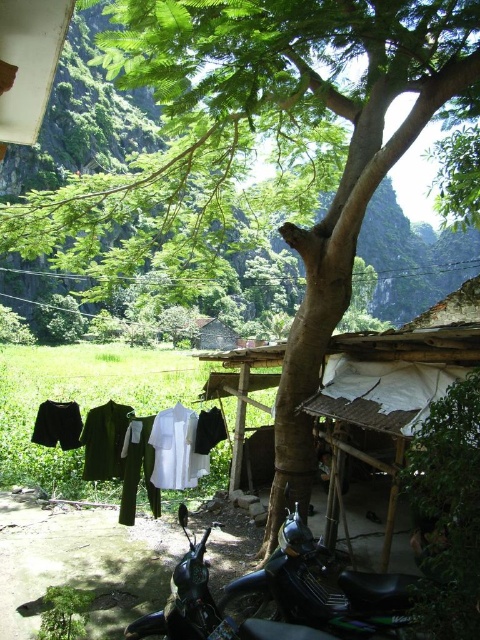
Between green matte motorcycle at lower center and white cotton shirt at center, which one appears on the right side from the viewer's perspective?

From the viewer's perspective, green matte motorcycle at lower center appears more on the right side.

Between green matte motorcycle at lower center and white cotton shirt at center, which one has more height?

white cotton shirt at center is taller.

Who is more forward, [328,592] or [123,440]?

Positioned in front is point [328,592].

Where is `green matte motorcycle at lower center`? green matte motorcycle at lower center is located at coordinates (322, 589).